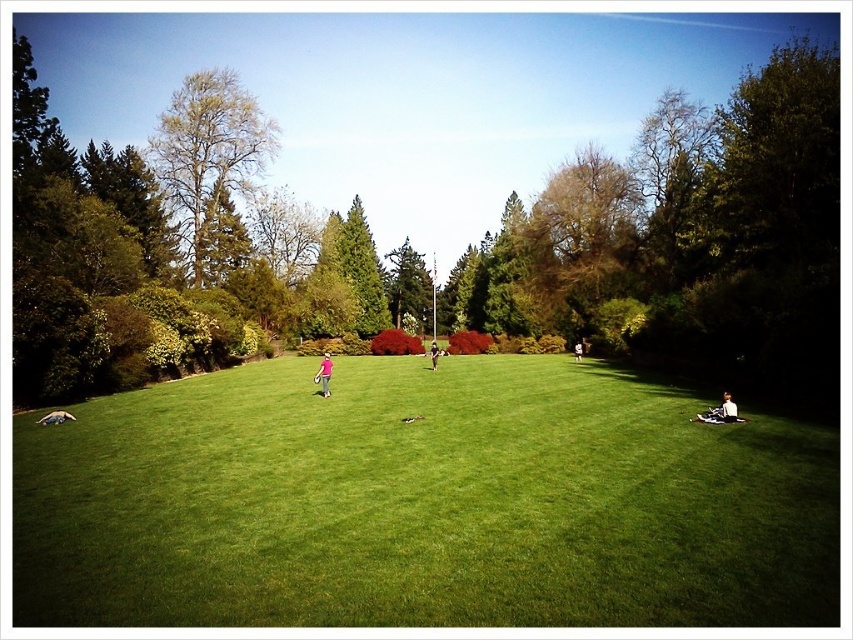
In the scene shown: Does green leafy tree at center have a greater width compared to dark brown leather jacket at center?

Yes.

Locate an element on the screen. green leafy tree at center is located at coordinates (688, 232).

The width and height of the screenshot is (853, 640). Identify the location of green leafy tree at center. (688, 232).

Can you confirm if green leafy tree at center is positioned below light brown leather jacket at lower right?

No.

Find the location of `green leafy tree at center`. green leafy tree at center is located at coordinates (688, 232).

Which is more to the left, green grass at center or white fabric at center?

green grass at center

Based on the photo, can you confirm if green grass at center is smaller than white fabric at center?

Correct, green grass at center occupies less space than white fabric at center.

Between point (436, 538) and point (577, 355), which one is positioned in front?

Point (436, 538)

Locate an element on the screen. green grass at center is located at coordinates (422, 502).